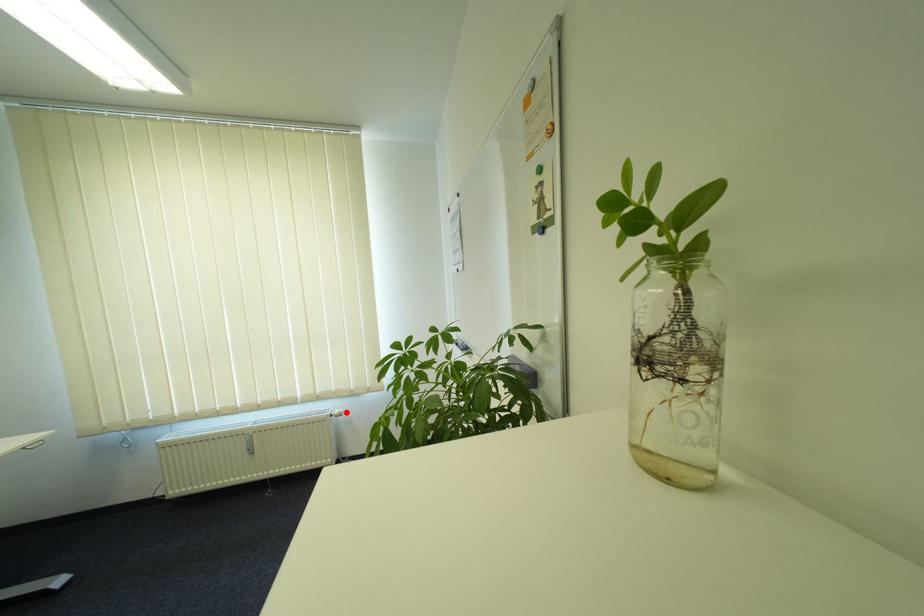
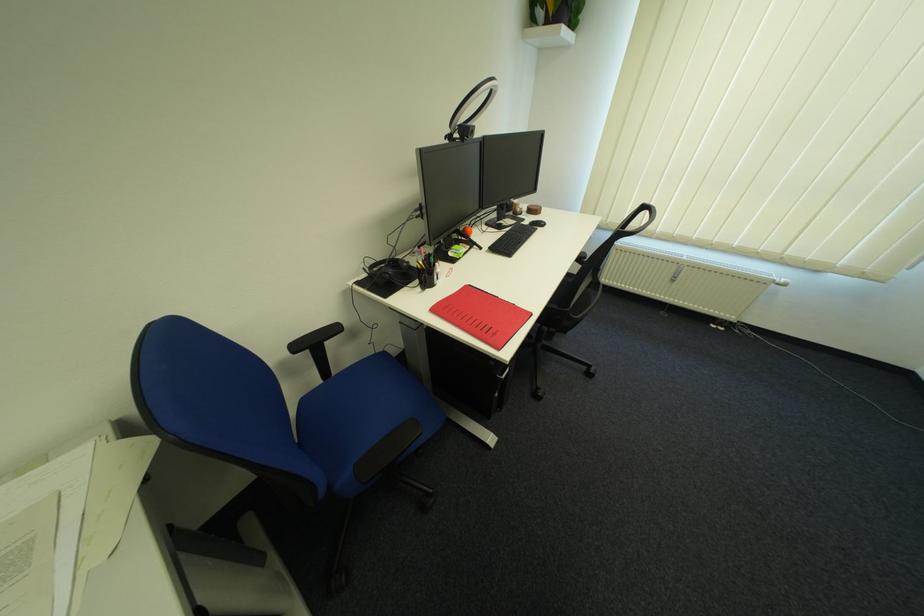
Find the pixel in the second image that matches the highlighted location in the first image.

(793, 281)